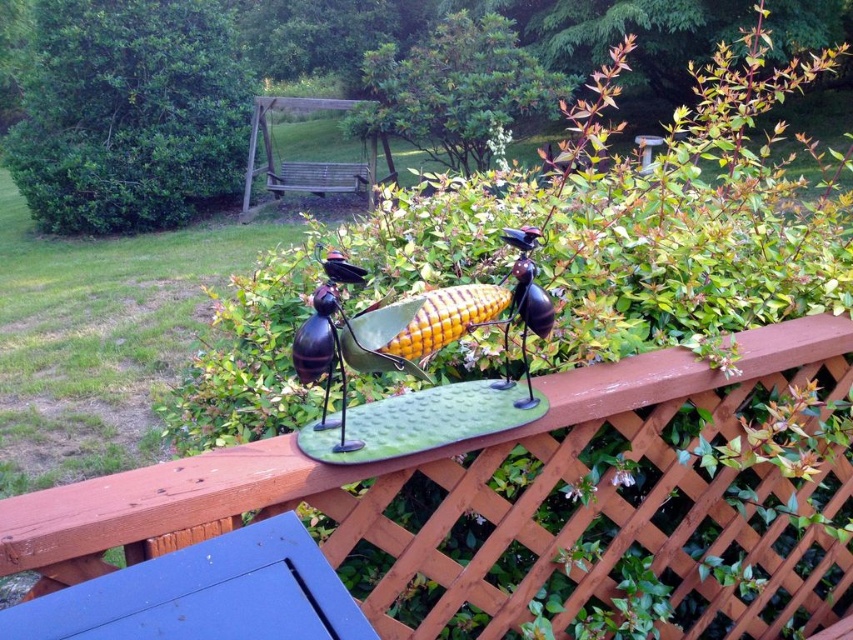
Question: Can you confirm if wooden lattice at center is thinner than green leafy bush at upper center?

Choices:
 (A) no
 (B) yes

Answer: (B)

Question: Among these objects, which one is farthest from the camera?

Choices:
 (A) wooden lattice at center
 (B) green leafy bush at upper center

Answer: (B)

Question: Can you confirm if wooden lattice at center is wider than green leafy bush at upper center?

Choices:
 (A) no
 (B) yes

Answer: (A)

Question: Which point appears farthest from the camera in this image?

Choices:
 (A) (467, 467)
 (B) (469, 24)

Answer: (B)

Question: Does wooden lattice at center have a lesser width compared to green leafy bush at upper center?

Choices:
 (A) yes
 (B) no

Answer: (A)

Question: Which object is farther from the camera taking this photo?

Choices:
 (A) green leafy bush at upper center
 (B) green leafy bush at upper left

Answer: (B)